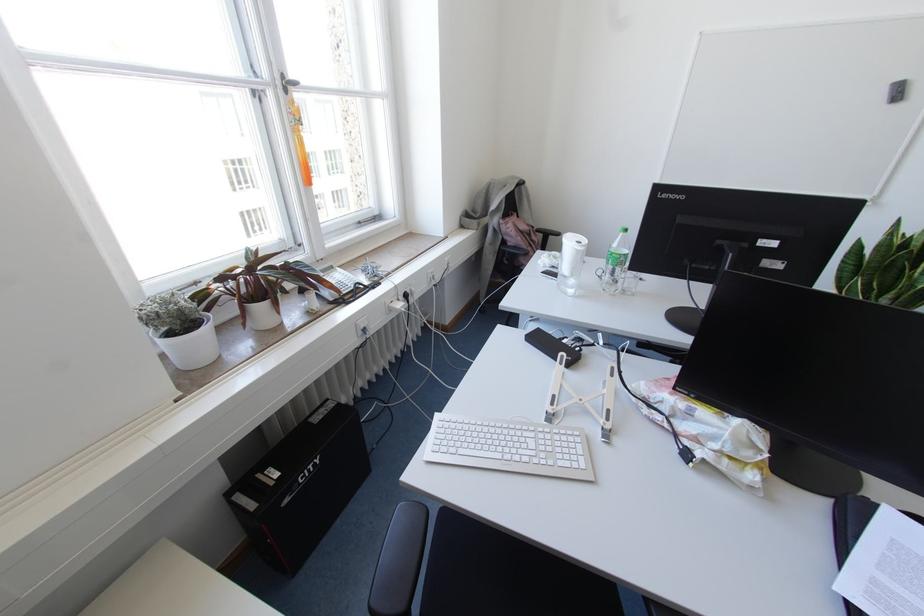
Where is `silver laptop stand`? The height and width of the screenshot is (616, 924). silver laptop stand is located at coordinates click(582, 398).